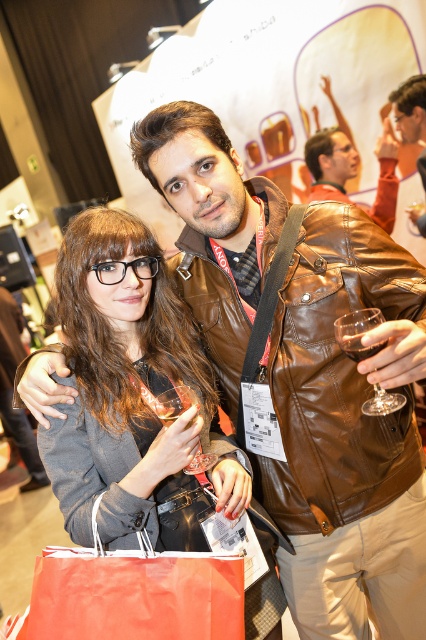
You are at the event and need to place your orange paper bag at lower left somewhere. Based on the scene, where would be a logical place to put it?

The orange paper bag at lower left is located at point (x=135, y=595), so you could place it on the floor near the individuals or on a nearby table if available.

You are at a conference and need to grab a drink quickly. You see a transparent glass at right and a clear glass wine glass at lower left. Which one is closer to you?

The transparent glass at right is closer to you because it is in front of the clear glass wine glass at lower left.

You are at a conference and need to grab your drink quickly. Which item should you reach for first to get the transparent glass at right without moving the orange paper bag at lower left?

The transparent glass at right is behind the orange paper bag at lower left, so you should reach for the orange paper bag at lower left first to access the transparent glass at right.